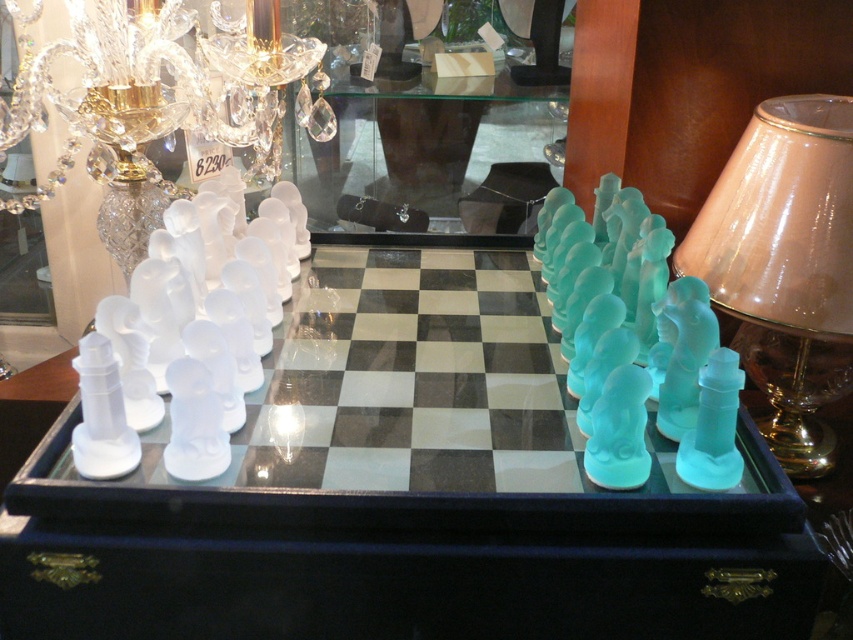
Question: Among these objects, which one is farthest from the camera?

Choices:
 (A) translucent glass chessboard at center
 (B) transparent glass table at center
 (C) translucent glass lampshade at right
 (D) clear crystal chandelier at upper left

Answer: (B)

Question: Which point is closer to the camera?

Choices:
 (A) translucent glass lampshade at right
 (B) translucent glass chessboard at center

Answer: (B)

Question: Which of these objects is positioned farthest from the clear crystal chandelier at upper left?

Choices:
 (A) translucent glass lampshade at right
 (B) translucent glass chessboard at center
 (C) transparent glass table at center

Answer: (A)

Question: Is translucent glass lampshade at right further to the viewer compared to clear crystal chandelier at upper left?

Choices:
 (A) no
 (B) yes

Answer: (A)

Question: Does translucent glass chessboard at center have a greater width compared to transparent glass table at center?

Choices:
 (A) yes
 (B) no

Answer: (A)

Question: Considering the relative positions of translucent glass chessboard at center and clear crystal chandelier at upper left in the image provided, where is translucent glass chessboard at center located with respect to clear crystal chandelier at upper left?

Choices:
 (A) above
 (B) below

Answer: (B)